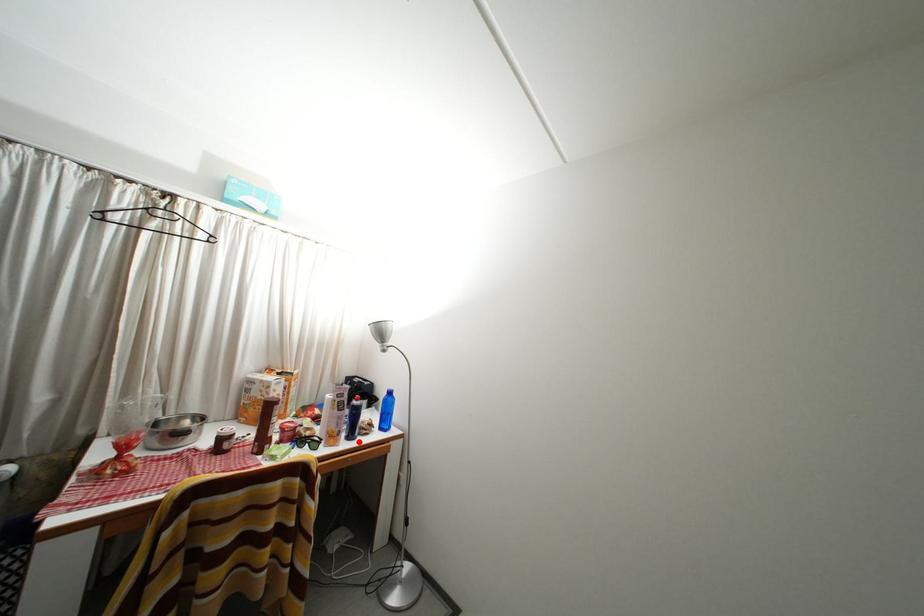
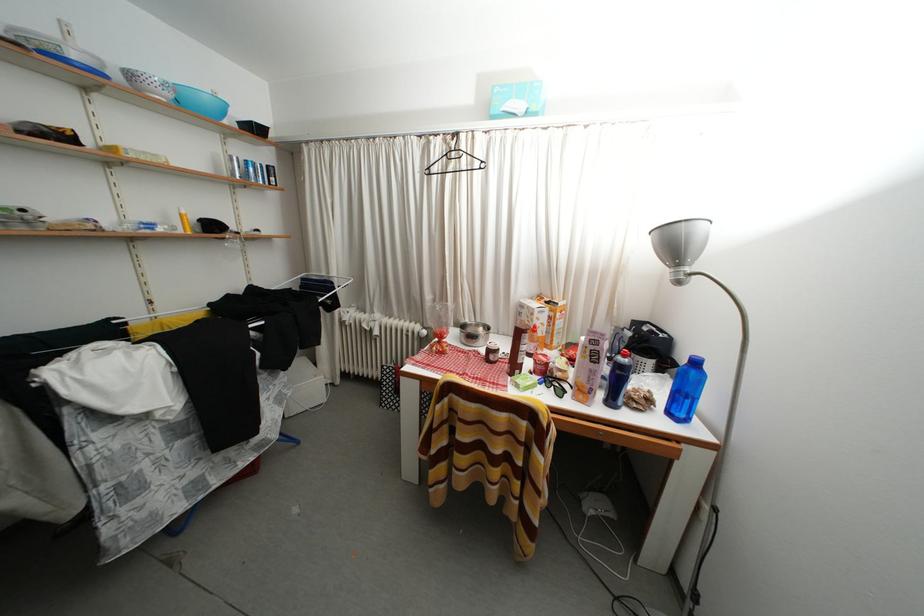
Find the pixel in the second image that matches the highlighted location in the first image.

(618, 408)